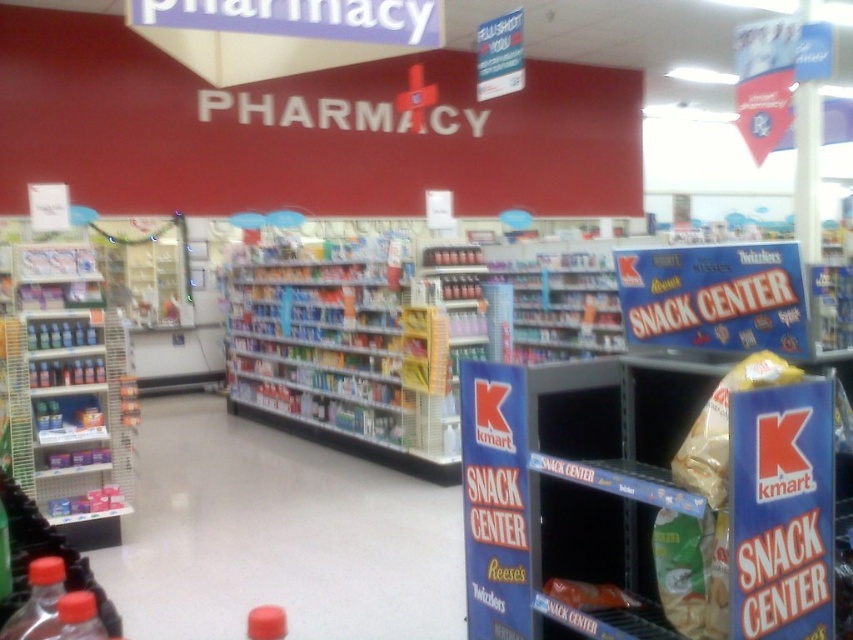
You are a store employee who needs to place a new candy display that is 3 feet wide. You see the matte plastic shelves at left and the matte plastic candy at center. Can you fit the display between them without moving either object?

The distance between the matte plastic shelves at left and the matte plastic candy at center is 11.28 feet. Since the display is only 3 feet wide, there is sufficient space to place it between them without moving either object.

Based on the photo, you are a customer in the Kmart store and want to find the snack center. You see the blue cardboard snack center at lower right and the matte plastic shelves at left. Which direction should you move to reach the snack center?

The blue cardboard snack center at lower right is in front of the matte plastic shelves at left, so you should move toward the blue cardboard snack center at lower right to reach the snack center.

You are a customer holding a shopping basket and want to place both the yellow matte snack bag at center right and the matte plastic candy at center in your basket. Which item should you pick up first if you want to ensure the smaller item doesn

The matte plastic candy at center is smaller, so you should pick it up first to place it into the basket before the larger yellow matte snack bag at center right.